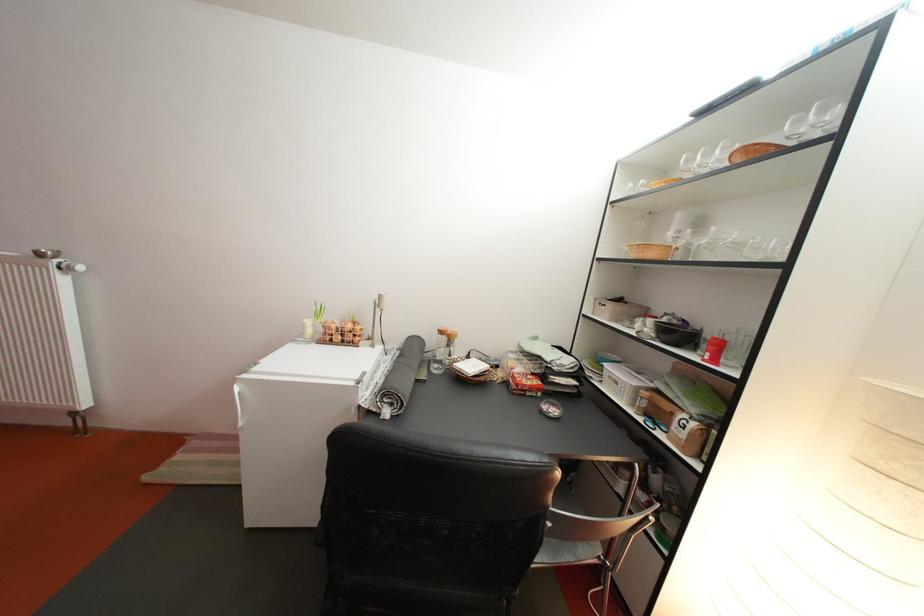
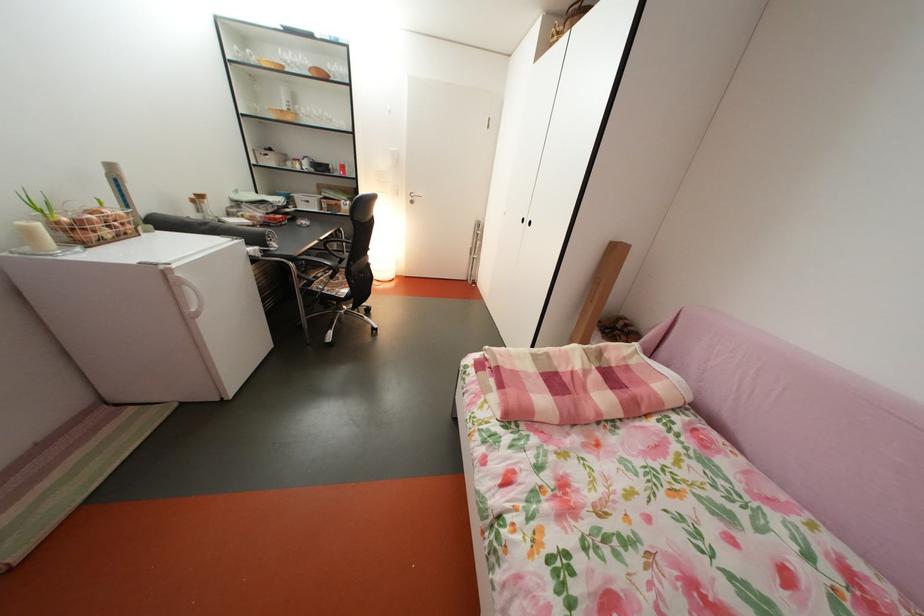
Locate, in the second image, the point that corresponds to (314,331) in the first image.

(41, 238)